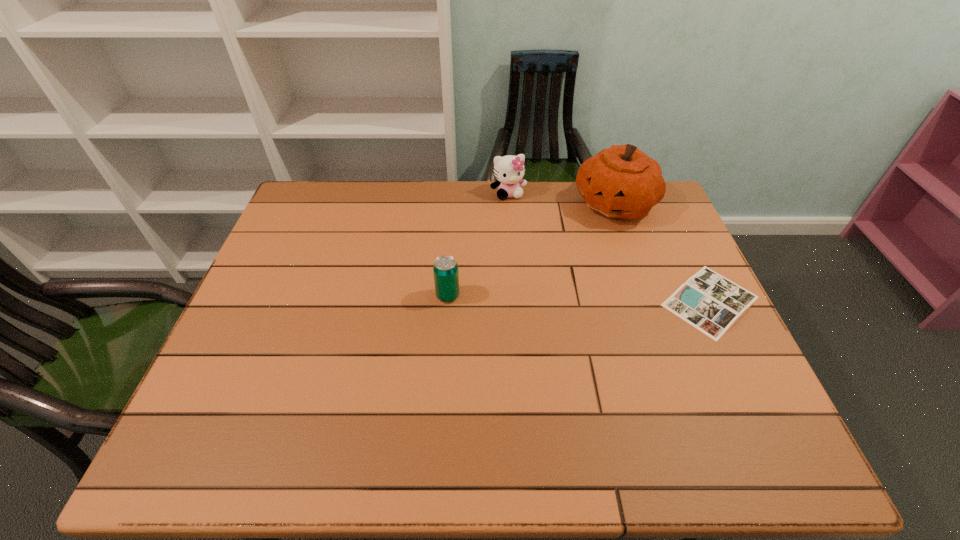
Locate an element on the screen. The height and width of the screenshot is (540, 960). vacant space on the desktop that is between the leftmost object and the shortest object and is positioned on the front-facing side of the pumpkin is located at coordinates (573, 298).

The height and width of the screenshot is (540, 960). Find the location of `vacant space on the desktop that is between the beer can and the shortest object and is positioned on the front-facing side of the third shortest object`. vacant space on the desktop that is between the beer can and the shortest object and is positioned on the front-facing side of the third shortest object is located at coordinates (546, 298).